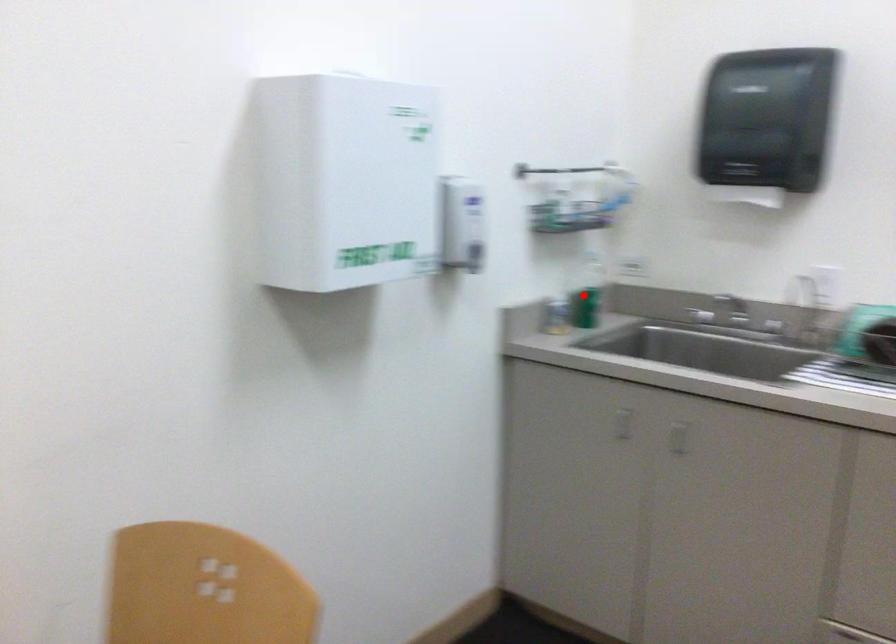
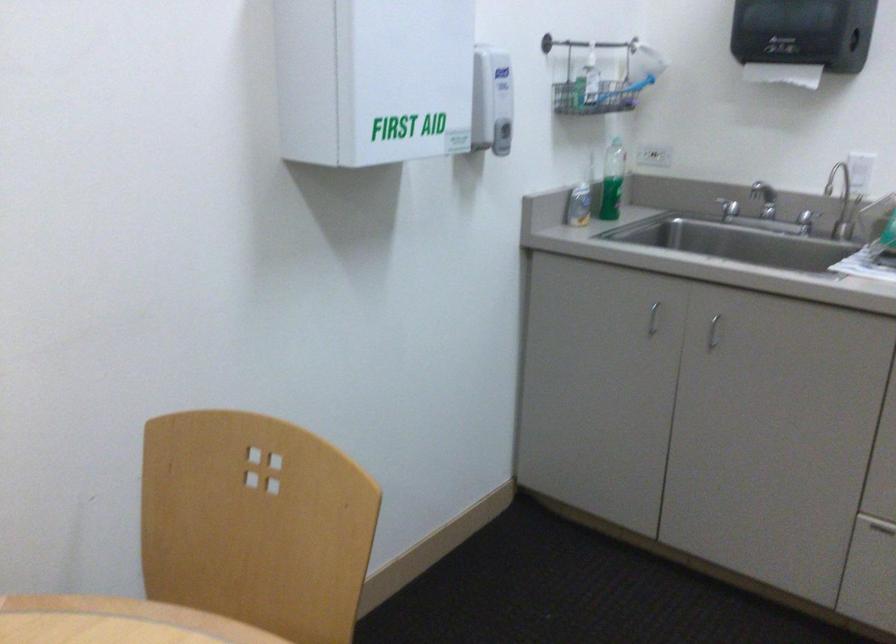
Locate, in the second image, the point that corresponds to the highlighted location in the first image.

(613, 181)